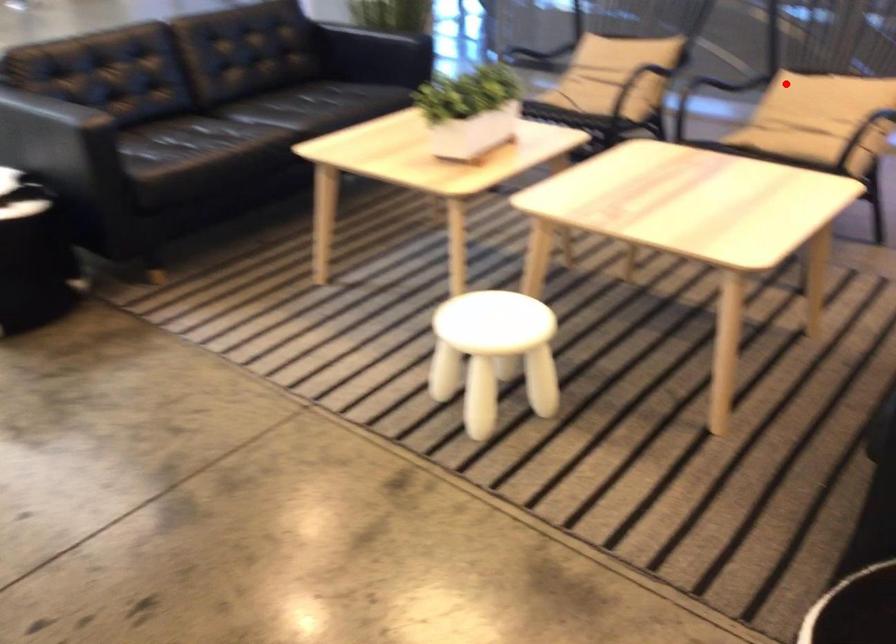
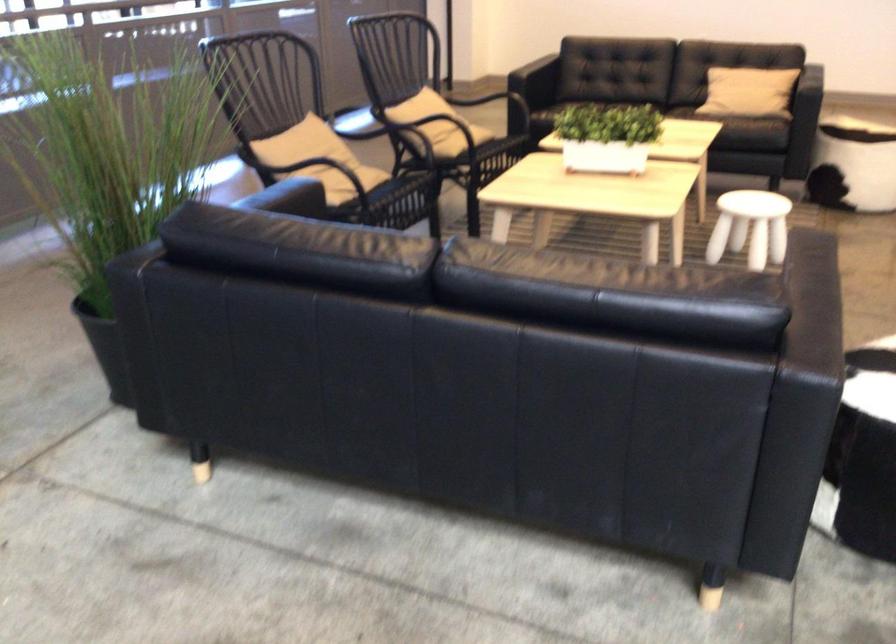
Locate, in the second image, the point that corresponds to the highlighted location in the first image.

(431, 111)